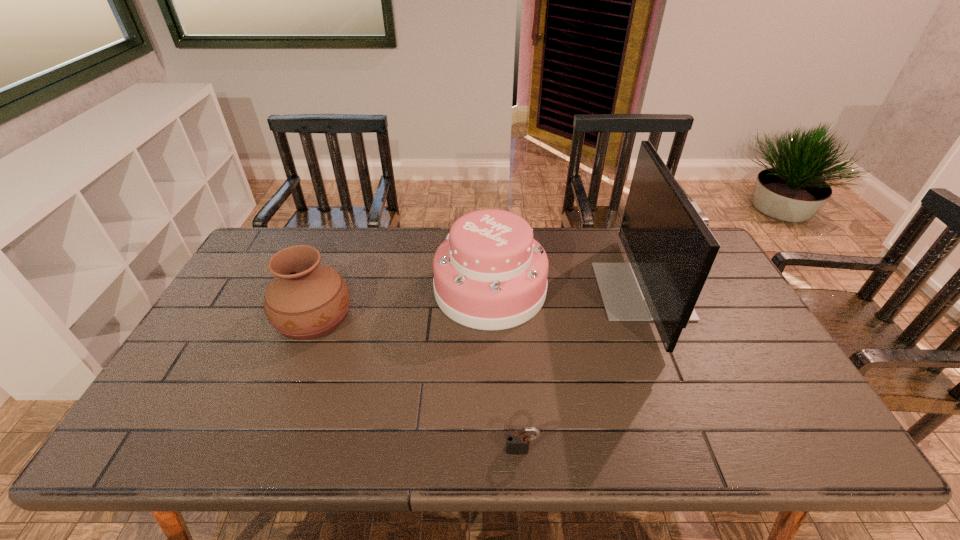
This screenshot has width=960, height=540. In the image, there is a desktop. In order to click on vacant space at the far left corner in this screenshot , I will do click(309, 230).

Locate an element on the screen. The image size is (960, 540). vacant area that lies between the padlock and the tallest object is located at coordinates (582, 370).

I want to click on vacant point located between the leftmost object and the cake, so click(402, 303).

Locate an element on the screen. free point between the padlock and the tallest object is located at coordinates (582, 370).

Locate an element on the screen. The width and height of the screenshot is (960, 540). vacant space in between the urn and the nearest object is located at coordinates (418, 383).

Identify the location of blank region between the cake and the computer monitor. The height and width of the screenshot is (540, 960). (565, 291).

Where is `blank region between the cake and the shortest object`? blank region between the cake and the shortest object is located at coordinates (506, 370).

Find the location of `free point between the nearest object and the cake`. free point between the nearest object and the cake is located at coordinates (506, 370).

This screenshot has width=960, height=540. Find the location of `free area in between the cake and the computer monitor`. free area in between the cake and the computer monitor is located at coordinates (565, 291).

What are the coordinates of `unoccupied position between the padlock and the computer monitor` in the screenshot? It's located at (582, 370).